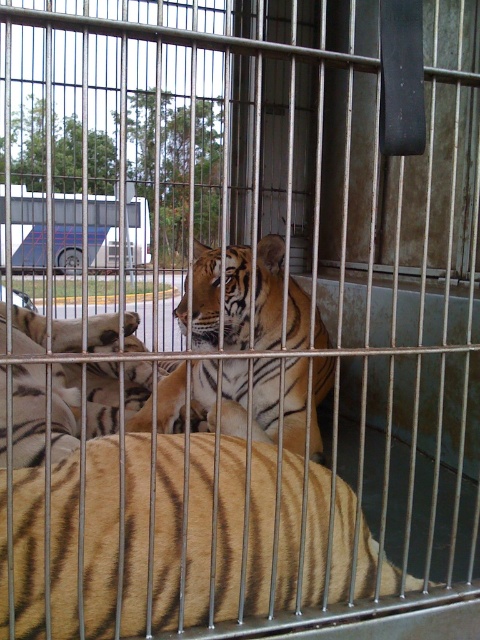
Question: Is the position of golden fur tiger at center more distant than that of orange-brown fur tiger at center?

Choices:
 (A) no
 (B) yes

Answer: (A)

Question: Which of the following is the farthest from the observer?

Choices:
 (A) (431, 582)
 (B) (324, 388)

Answer: (B)

Question: Can you confirm if golden fur tiger at center is smaller than orange-brown fur tiger at center?

Choices:
 (A) no
 (B) yes

Answer: (B)

Question: Among these objects, which one is nearest to the camera?

Choices:
 (A) golden fur tiger at center
 (B) orange-brown fur tiger at center

Answer: (A)

Question: Is golden fur tiger at center above orange-brown fur tiger at center?

Choices:
 (A) yes
 (B) no

Answer: (B)

Question: Which point appears farthest from the camera in this image?

Choices:
 (A) (235, 428)
 (B) (225, 582)

Answer: (A)